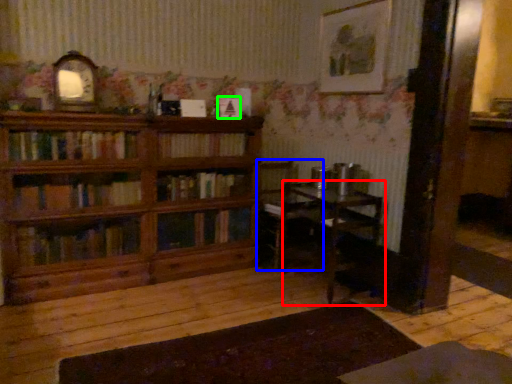
Question: Considering the real-world distances, which object is farthest from table (highlighted by a red box)? chair (highlighted by a blue box) or book (highlighted by a green box)?

Choices:
 (A) chair
 (B) book

Answer: (B)